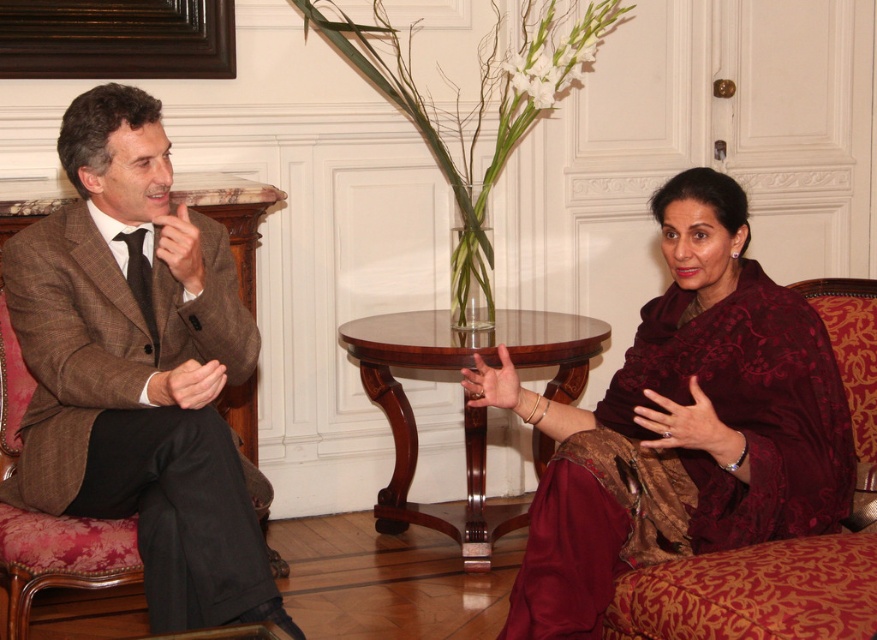
Question: Which of the following is the closest to the observer?

Choices:
 (A) click(x=696, y=445)
 (B) click(x=134, y=492)
 (C) click(x=195, y=278)
 (D) click(x=474, y=451)

Answer: (A)

Question: Which is nearer to the brown textured suit at left?

Choices:
 (A) smooth skin hand at center
 (B) maroon fabric hand at center
 (C) burgundy velvet robe at right
 (D) matte brown hand at center

Answer: (D)

Question: Is brown textured suit at left below matte brown hand at center?

Choices:
 (A) no
 (B) yes

Answer: (B)

Question: Is maroon fabric hand at center to the left of matte brown hand at center from the viewer's perspective?

Choices:
 (A) yes
 (B) no

Answer: (B)

Question: In this image, where is maroon fabric hand at center located relative to matte brown suit at left?

Choices:
 (A) below
 (B) above

Answer: (A)

Question: Which of the following is the farthest from the observer?

Choices:
 (A) (738, 420)
 (B) (220, 376)
 (C) (483, 380)

Answer: (C)